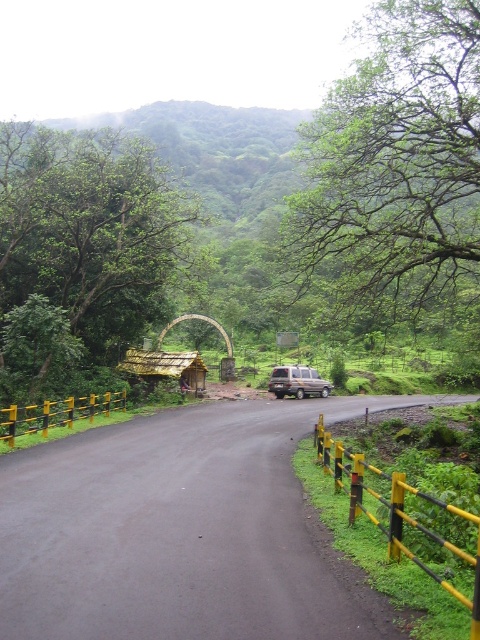
In the scene shown: Does green leafy tree at center lie in front of metallic silver van at center?

That is True.

The height and width of the screenshot is (640, 480). Identify the location of green leafy tree at center. (91, 230).

You are a GUI agent. You are given a task and a screenshot of the screen. Output one action in this format:
    pyautogui.click(x=<x>, y=<y>)
    Task: Click on the green leafy tree at center
    The width and height of the screenshot is (480, 640).
    Given the screenshot: What is the action you would take?
    (91, 230)

Is point (331, 173) more distant than point (317, 376)?

No, (331, 173) is closer to viewer.

Between green leafy tree at upper center and metallic silver van at center, which one is positioned higher?

green leafy tree at upper center

Is point (474, 236) positioned before point (292, 376)?

Yes, it is.

Locate an element on the screen. This screenshot has width=480, height=640. green leafy tree at upper center is located at coordinates (395, 161).

Which of these two, green leafy tree at upper center or green leafy tree at center, stands shorter?

With less height is green leafy tree at center.

In order to click on green leafy tree at upper center in this screenshot , I will do `click(395, 161)`.